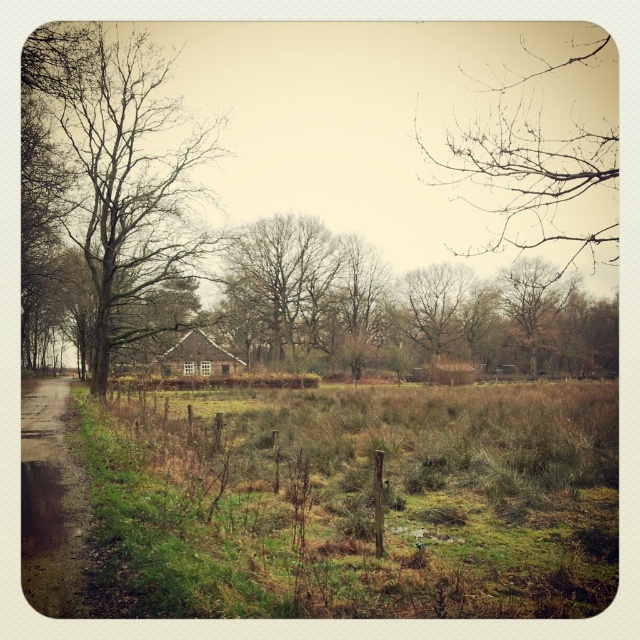
Does brown leafless tree at center appear over bare branches at left?

Actually, brown leafless tree at center is below bare branches at left.

Can you confirm if brown leafless tree at center is positioned below bare branches at left?

Yes.

Locate an element on the screen. Image resolution: width=640 pixels, height=640 pixels. brown leafless tree at center is located at coordinates (401, 307).

Find the location of `brown leafless tree at center`. brown leafless tree at center is located at coordinates (401, 307).

Does brown leafless tree at center have a greater height compared to brown wooden hut at center?

Indeed, brown leafless tree at center has a greater height compared to brown wooden hut at center.

Can you confirm if brown leafless tree at center is thinner than brown wooden hut at center?

No, brown leafless tree at center is not thinner than brown wooden hut at center.

Is point (412, 294) farther from viewer compared to point (202, 337)?

Yes, point (412, 294) is farther from viewer.

Locate an element on the screen. The image size is (640, 640). brown leafless tree at center is located at coordinates (401, 307).

Can you confirm if green grassy field at center is taller than brown wooden hut at center?

Incorrect, green grassy field at center's height is not larger of brown wooden hut at center's.

Can you confirm if green grassy field at center is smaller than brown wooden hut at center?

Actually, green grassy field at center might be larger than brown wooden hut at center.

Is point (611, 568) farther from viewer compared to point (208, 349)?

No, (611, 568) is in front of (208, 349).

Locate an element on the screen. green grassy field at center is located at coordinates (358, 500).